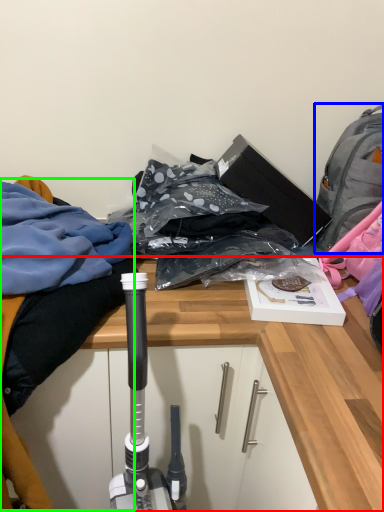
Question: Based on their relative distances, which object is farther from desk (highlighted by a red box)? Choose from backpack (highlighted by a blue box) and clothing (highlighted by a green box).

Choices:
 (A) backpack
 (B) clothing

Answer: (A)